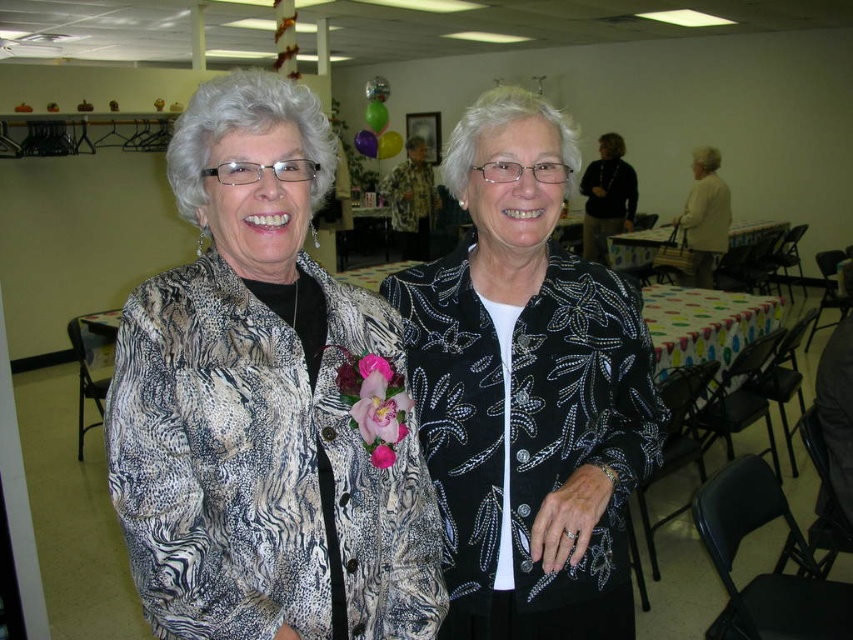
Is zebra print jacket at center smaller than black sequined jacket at center?

Correct, zebra print jacket at center occupies less space than black sequined jacket at center.

Is zebra print jacket at center to the right of black sequined jacket at center from the viewer's perspective?

No, zebra print jacket at center is not to the right of black sequined jacket at center.

Image resolution: width=853 pixels, height=640 pixels. In order to click on zebra print jacket at center in this screenshot , I will do `click(260, 404)`.

Where is `zebra print jacket at center`? This screenshot has width=853, height=640. zebra print jacket at center is located at coordinates (260, 404).